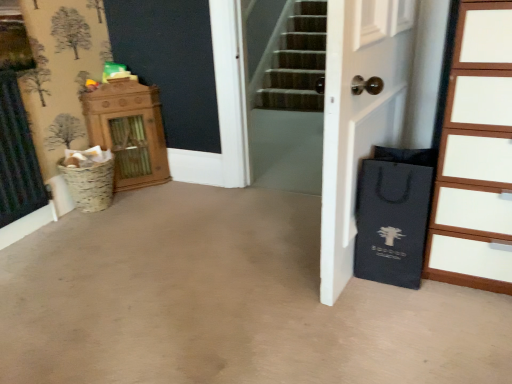
Question: From the image's perspective, is wooden cabinet at left located above or below white matte door at center?

Choices:
 (A) above
 (B) below

Answer: (A)

Question: Does point (116, 180) appear closer or farther from the camera than point (404, 77)?

Choices:
 (A) closer
 (B) farther

Answer: (B)

Question: Based on their relative distances, which object is farther from the wooden cabinet at left?

Choices:
 (A) black paper bag at right
 (B) white matte door at center
 (C) wooden chest of drawers at right

Answer: (C)

Question: Which of these objects is positioned farthest from the wooden cabinet at left?

Choices:
 (A) white matte door at center
 (B) black paper bag at right
 (C) wooden chest of drawers at right

Answer: (C)